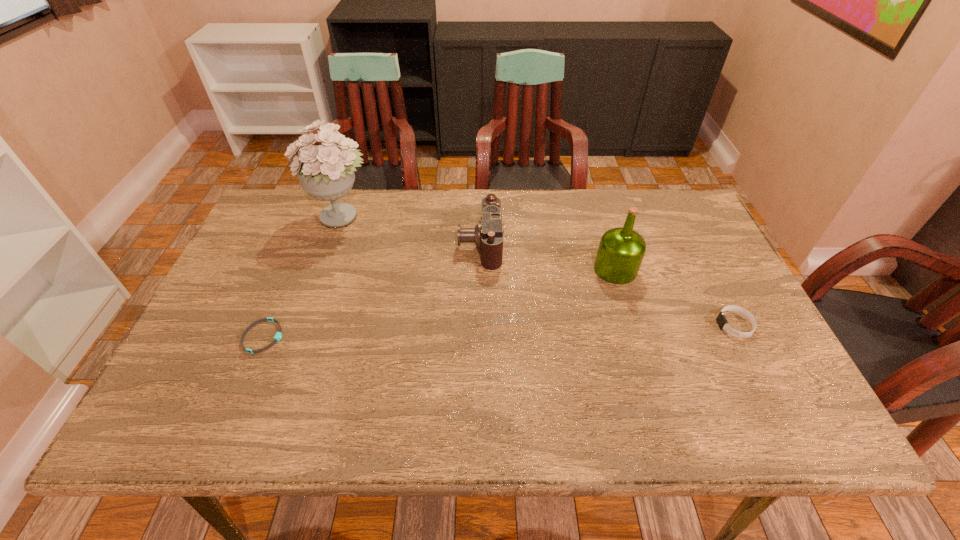
Identify the location of free space located 0.100m on the front of the fourth object from left to right. pos(629,314).

Identify the location of blank space located on the front-facing side of the third object from right to left. (424, 244).

This screenshot has height=540, width=960. What are the coordinates of `free spot located on the front-facing side of the third object from right to left` in the screenshot? It's located at (322, 244).

The width and height of the screenshot is (960, 540). I want to click on vacant point located 0.210m on the front-facing side of the third object from right to left, so click(387, 244).

Locate an element on the screen. The height and width of the screenshot is (540, 960). vacant space situated 0.090m on the outer surface of the right wristband is located at coordinates (682, 325).

Image resolution: width=960 pixels, height=540 pixels. Find the location of `free region located on the outer surface of the right wristband`. free region located on the outer surface of the right wristband is located at coordinates (596, 325).

Find the location of a particular element. The height and width of the screenshot is (540, 960). vacant space located on the outer surface of the right wristband is located at coordinates (609, 325).

Locate an element on the screen. free location located on the buckle of the shortest object is located at coordinates (433, 336).

The height and width of the screenshot is (540, 960). Identify the location of bouquet that is at the far edge. (326, 172).

This screenshot has width=960, height=540. What are the coordinates of `camera that is positioned at the far edge` in the screenshot? It's located at (488, 235).